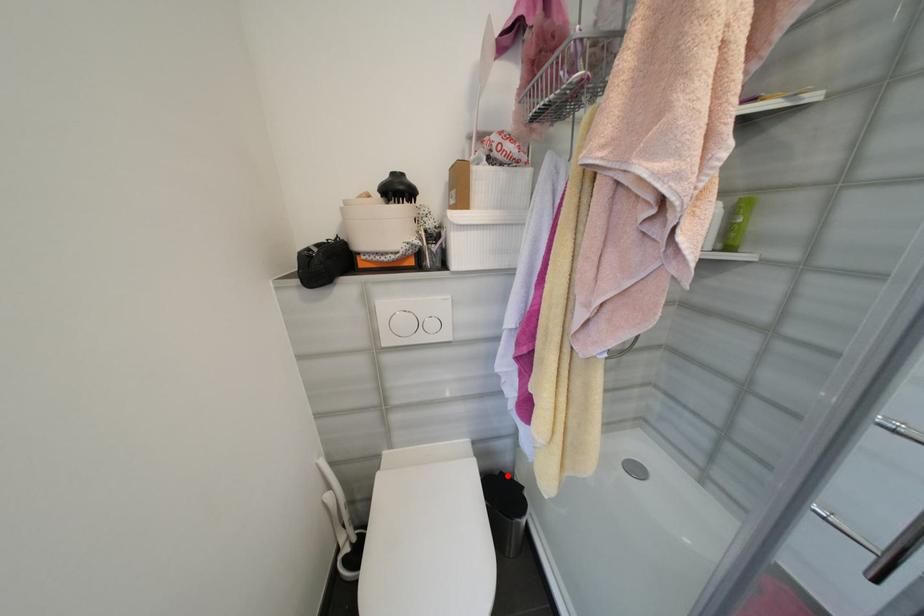
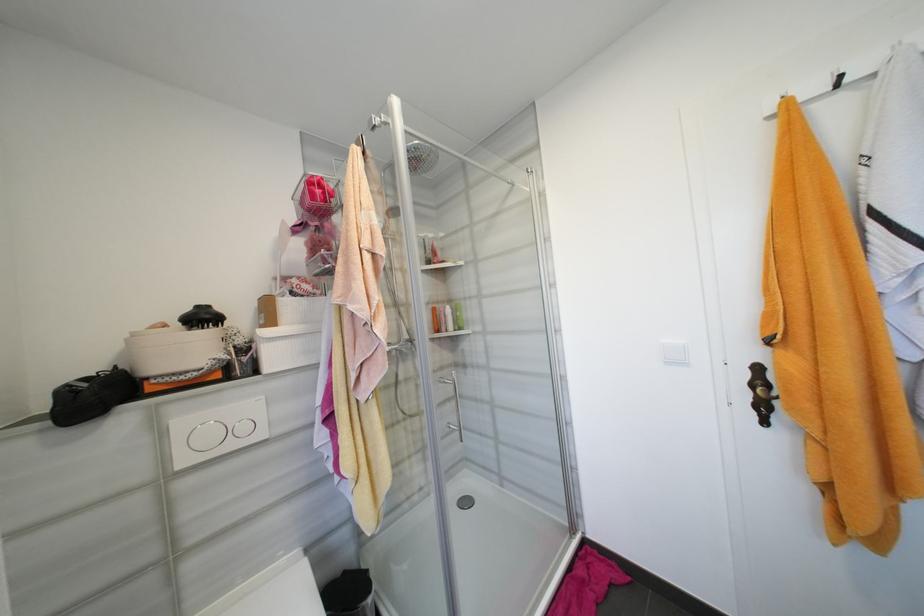
Where in the second image is the point corresponding to the highlighted location from the first image?

(350, 573)